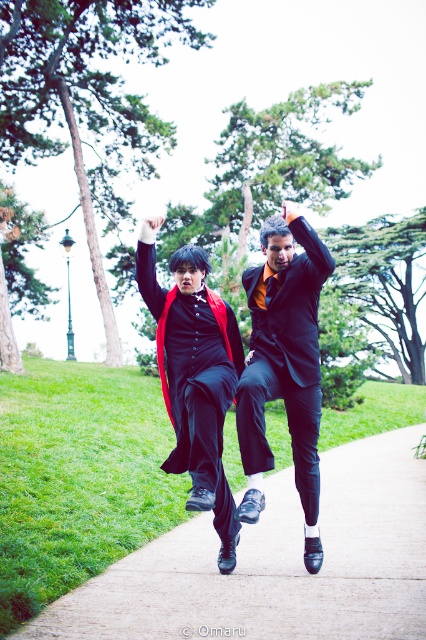
You are a photographer standing at the camera position. You want to focus on the point that is closer to you. Which point should you choose between point (250, 458) and point (210, 387)?

Point (250, 458) is closer to the camera than point (210, 387), so you should choose point (250, 458) to focus on.

You are standing on the paved concrete at center and want to throw a ball to the shiny black suit at center. Considering their positions, will the ball need to travel upwards or downwards to reach them?

The paved concrete at center is closer to the viewer than shiny black suit at center, so the ball will need to travel upwards to reach the shiny black suit at center.